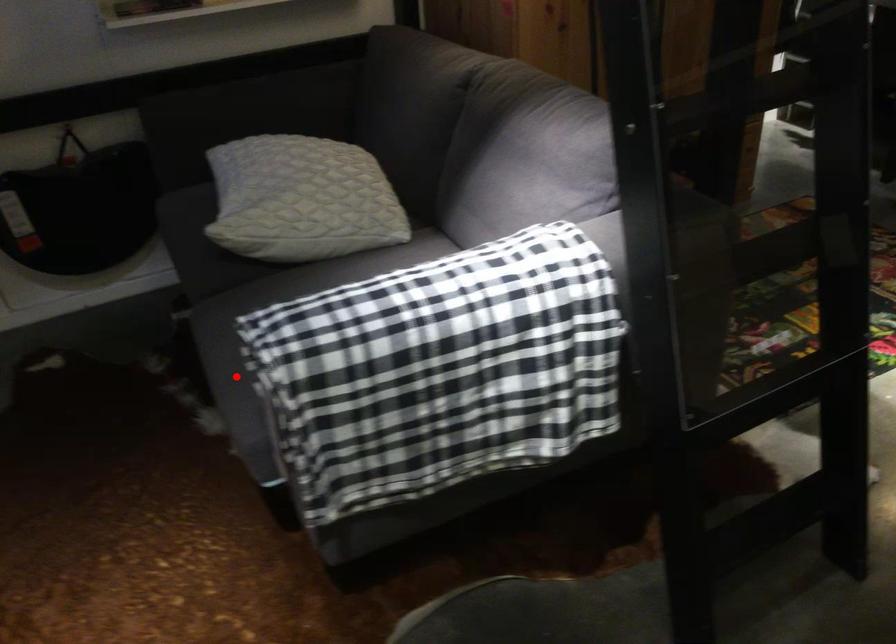
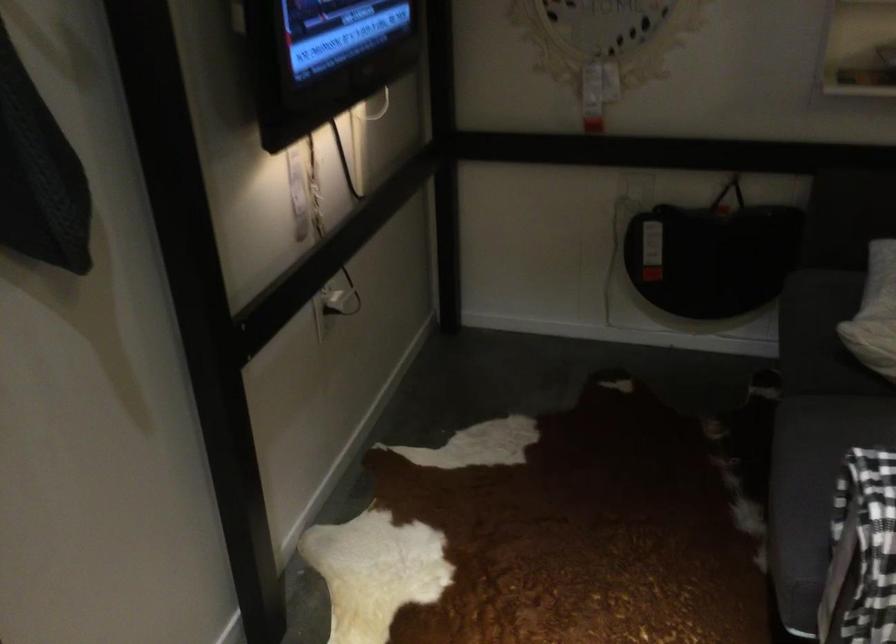
Find the pixel in the second image that matches the highlighted location in the first image.

(805, 494)